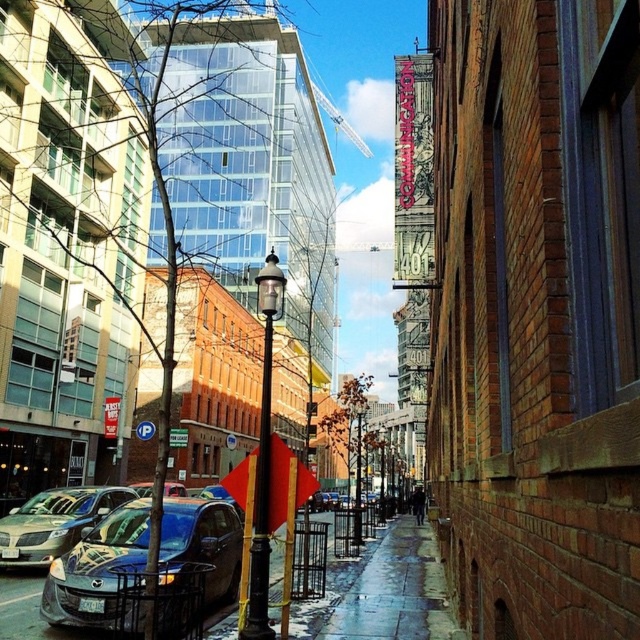
You are standing at the point with coordinates point (257, 529) and want to walk to the point with coordinates point (129, 621). Which direction should you move relative to the street layout?

Since point (129, 621) is in front of point (257, 529), you should move forward along the street towards point (129, 621).

You are standing at the sidewalk on this vibrant urban street. You notice two points marked in the scene. The first is at coordinate point (344,634) and the second is at coordinate point (6,547). Which of these two points is nearer to your current position?

Point (344,634) is closer to the camera than point (6,547), so the first point is nearer to your current position.